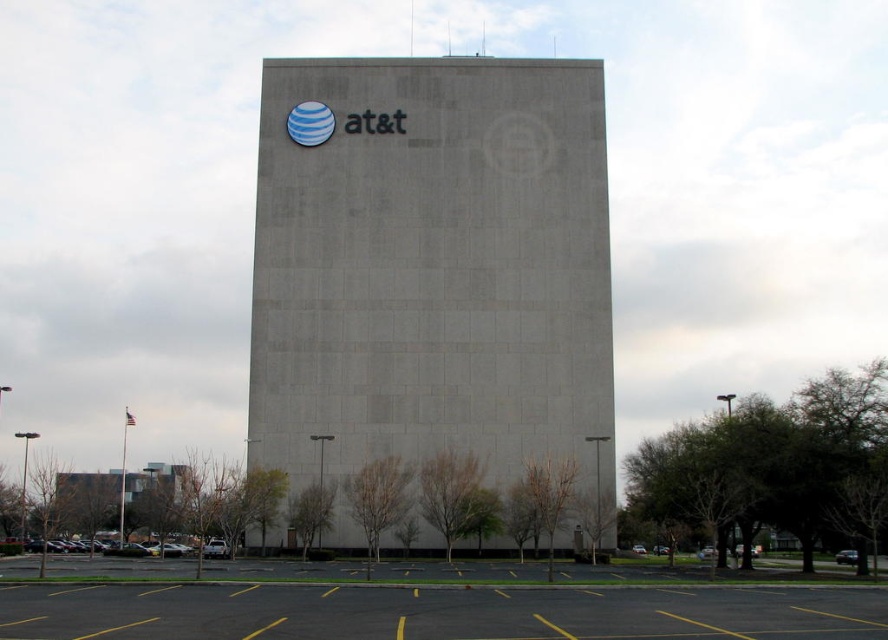
You are standing at the point marked by coordinates point (427, 600). Looking towards the AT T building, which direction would you face?

The point (427, 600) corresponds to the yellow asphalt parking lot at lower center. Since the building is in front of the parking lot, facing the building from the parking lot would mean you are facing north. Therefore, you should face north to look towards the AT T building.

Looking at this image, you are standing in front of the gray concrete building at center and want to walk to the yellow asphalt parking lot at lower center. Which direction should you face to move towards the parking lot?

You should face away from the gray concrete building at center because the yellow asphalt parking lot at lower center is behind the building, as the building is closer to you than the parking lot.